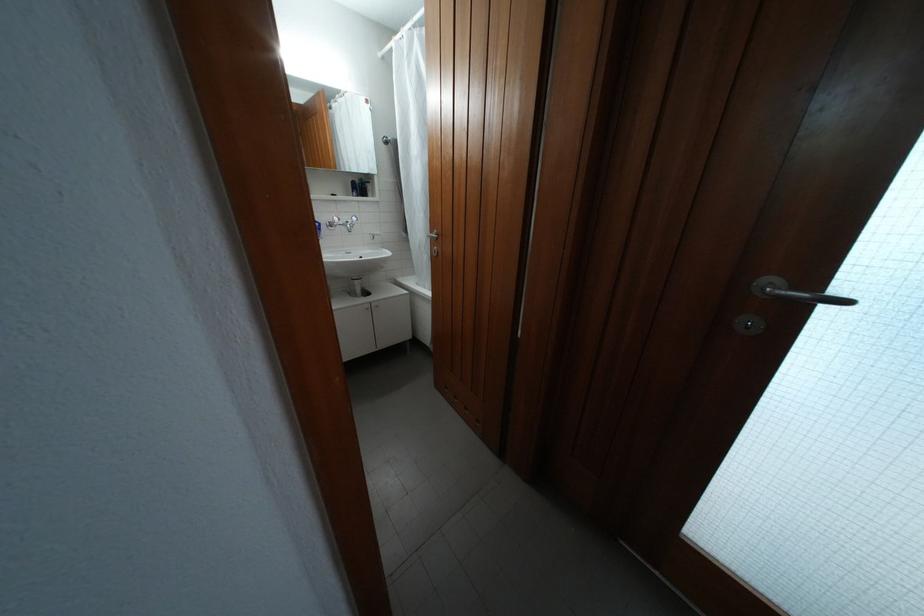
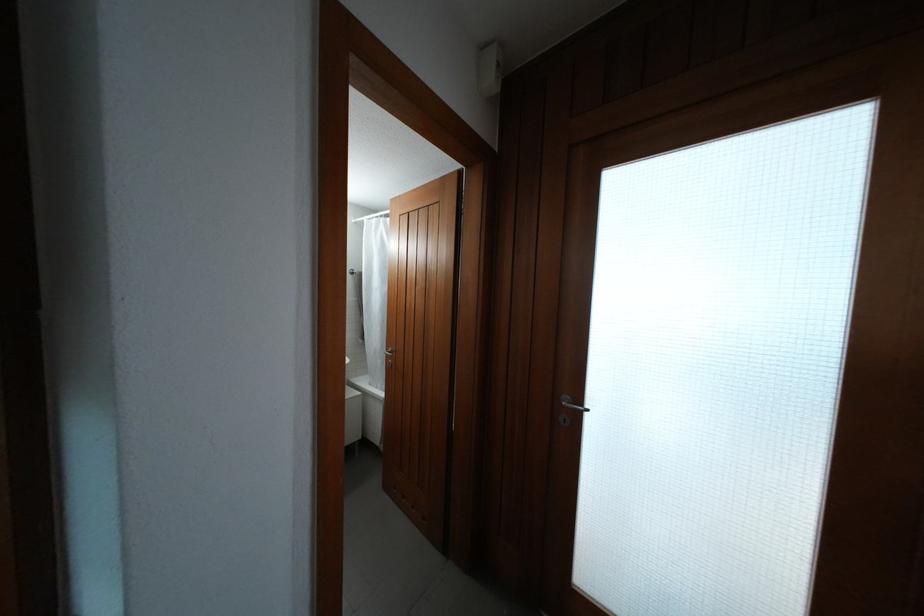
Question: In a continuous first-person perspective shot, in which direction is the camera moving?

Choices:
 (A) Left
 (B) Right
 (C) Forward
 (D) Backward

Answer: (D)